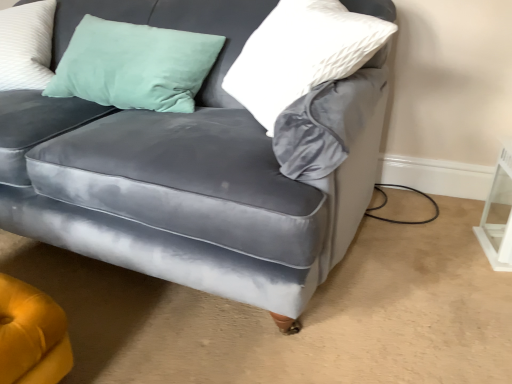
At what (x,y) coordinates should I click in order to perform the action: click on free space to the left of white glossy table at lower right. Please return your answer as a coordinate pair (x, y). This screenshot has height=384, width=512. Looking at the image, I should click on (453, 255).